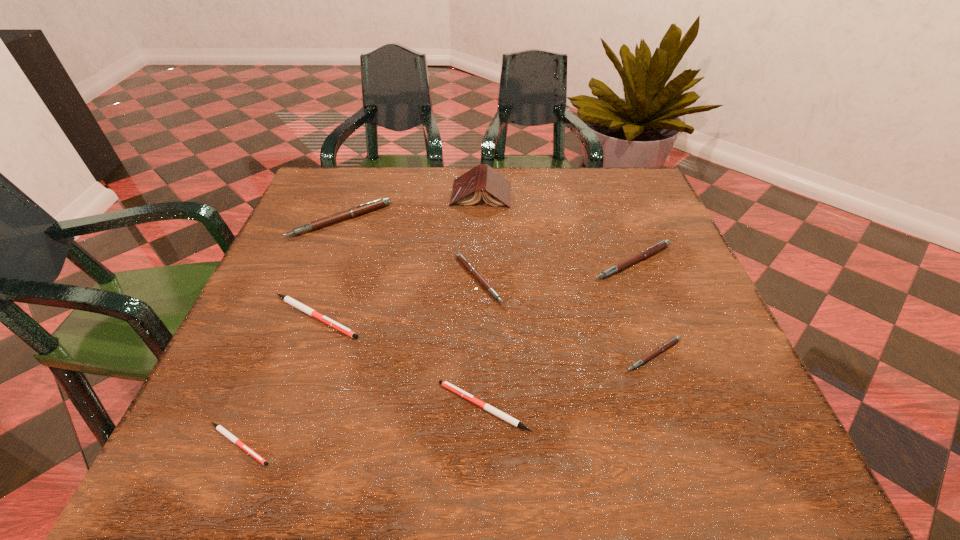
Image resolution: width=960 pixels, height=540 pixels. In order to click on the shortest object in this screenshot , I will do `click(222, 430)`.

Where is `the smallest white pen`? The height and width of the screenshot is (540, 960). the smallest white pen is located at coordinates point(222,430).

Locate an element on the screen. This screenshot has height=540, width=960. free spot located 0.080m on the front of the book is located at coordinates (481, 227).

Locate an element on the screen. vacant space situated at the nib of the farthest pen is located at coordinates (308, 305).

Locate an element on the screen. vacant space situated 0.160m at the nib of the third tallest object is located at coordinates (662, 341).

The image size is (960, 540). I want to click on vacant space positioned at the nib of the third pink pen from right to left, so click(626, 279).

Locate an element on the screen. This screenshot has height=540, width=960. vacant point located on the clicker of the biggest white pen is located at coordinates (429, 316).

At what (x,y) coordinates should I click in order to perform the action: click on vacant space located 0.090m at the nib of the nearest pink pen. Please return your answer as a coordinate pair (x, y). The width and height of the screenshot is (960, 540). Looking at the image, I should click on (676, 419).

Identify the location of blank space located on the clicker of the rightmost white pen. (228, 407).

Where is `vacant space situated 0.320m on the clicker of the rightmost white pen`? vacant space situated 0.320m on the clicker of the rightmost white pen is located at coordinates (246, 407).